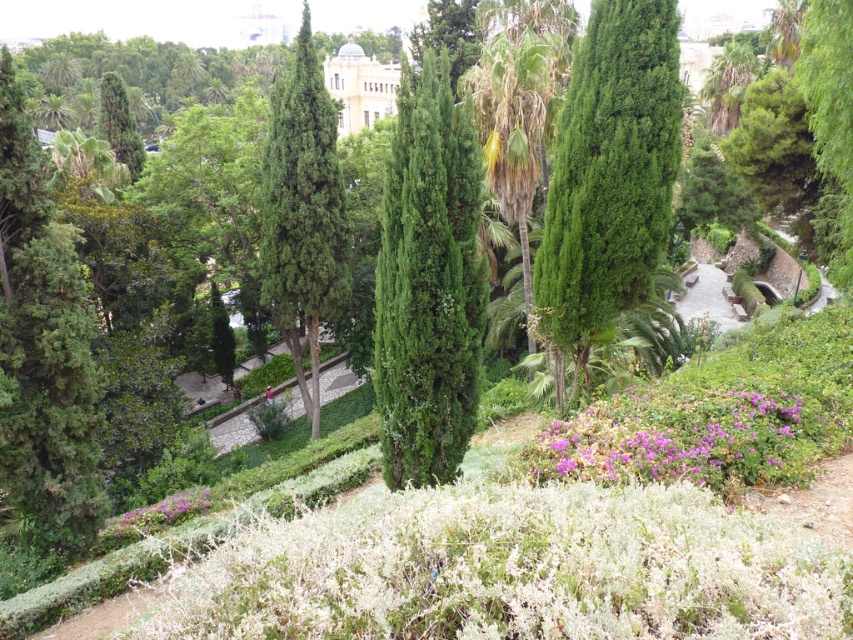
Question: Based on their relative distances, which object is nearer to the green textured cypress at center?

Choices:
 (A) green needle-like at center
 (B) purple matte flowers at center

Answer: (A)

Question: Can you confirm if purple matte flowers at center is positioned to the left of green textured cypress at center?

Choices:
 (A) yes
 (B) no

Answer: (B)

Question: Is green needle-like at center closer to the viewer compared to green textured palm tree at center?

Choices:
 (A) no
 (B) yes

Answer: (B)

Question: Where is green textured tree at center located in relation to green needle-like at center in the image?

Choices:
 (A) left
 (B) right

Answer: (A)

Question: Which object is the farthest from the green textured palm tree at center?

Choices:
 (A) purple matte flower at lower left
 (B) green needle-like at center
 (C) green textured cypress at center
 (D) purple matte flowers at center

Answer: (A)

Question: Which object is farther from the camera taking this photo?

Choices:
 (A) green textured cypress at center
 (B) purple matte flowers at center
 (C) green textured tree at center

Answer: (A)